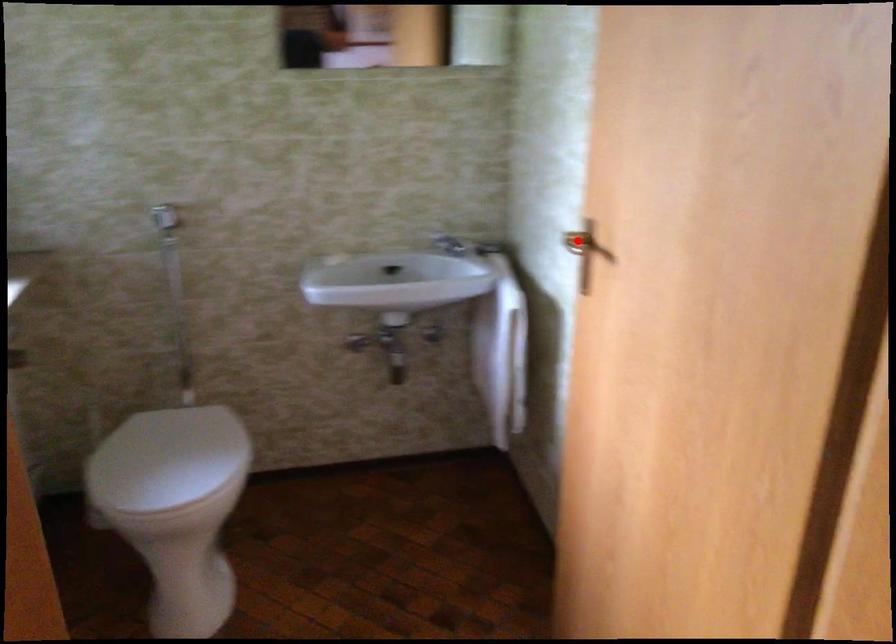
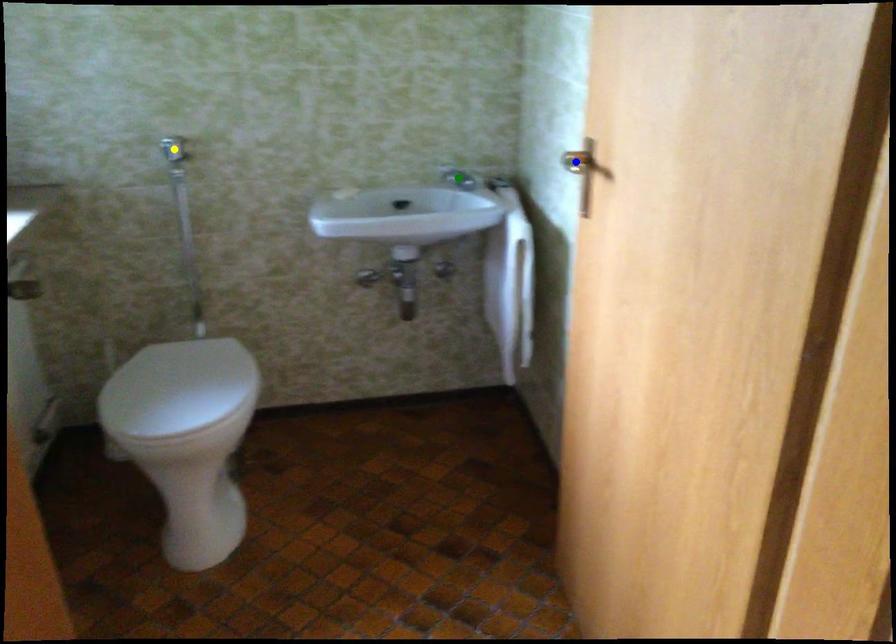
Question: I am providing you with two images of the same scene from different viewpoints. A red point is marked on the first image. You are given multiple points on the second image. In image 2, which mark is for the same physical point as the one in image 1?

Choices:
 (A) green point
 (B) blue point
 (C) yellow point

Answer: (B)